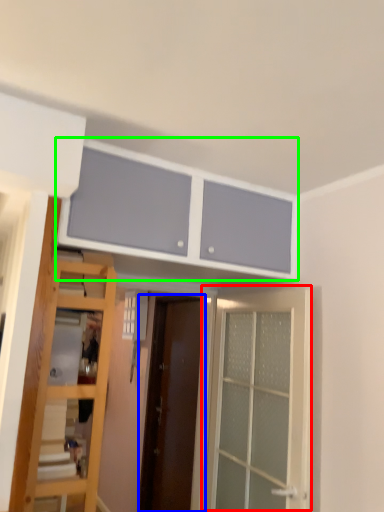
Question: Considering the real-world distances, which object is farthest from door (highlighted by a red box)? door (highlighted by a blue box) or cabinetry (highlighted by a green box)?

Choices:
 (A) door
 (B) cabinetry

Answer: (A)